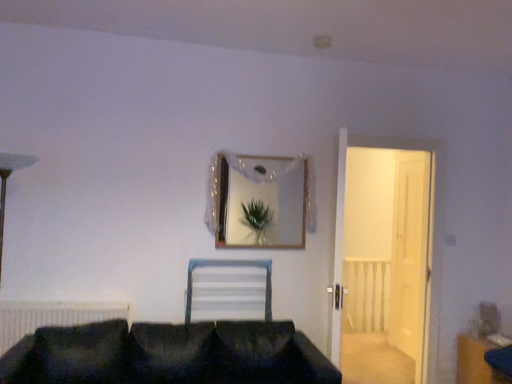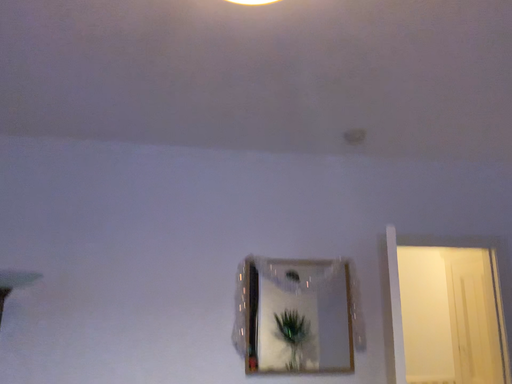
Question: Which way did the camera rotate in the video?

Choices:
 (A) rotated downward
 (B) rotated upward

Answer: (B)